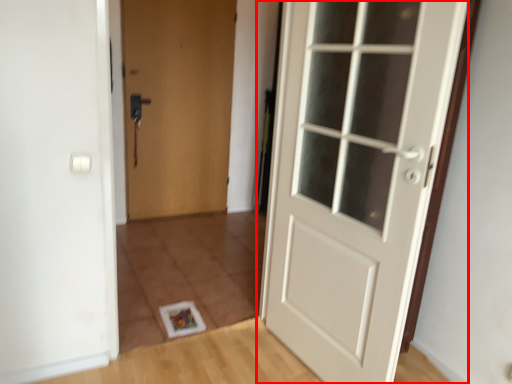
Question: Considering the relative positions of door (annotated by the red box) and door in the image provided, where is door (annotated by the red box) located with respect to the staircase?

Choices:
 (A) left
 (B) right

Answer: (B)